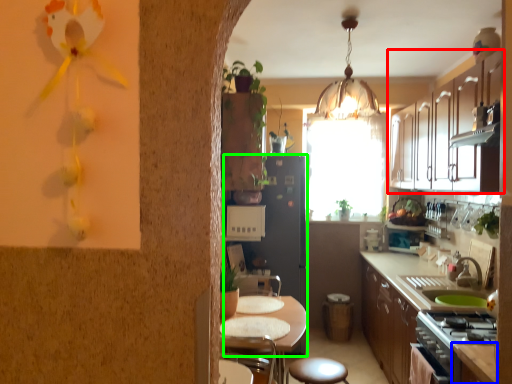
Question: Which object is the farthest from cabinetry (highlighted by a red box)? Choose among these: counter top (highlighted by a blue box) or fridge (highlighted by a green box).

Choices:
 (A) counter top
 (B) fridge

Answer: (A)